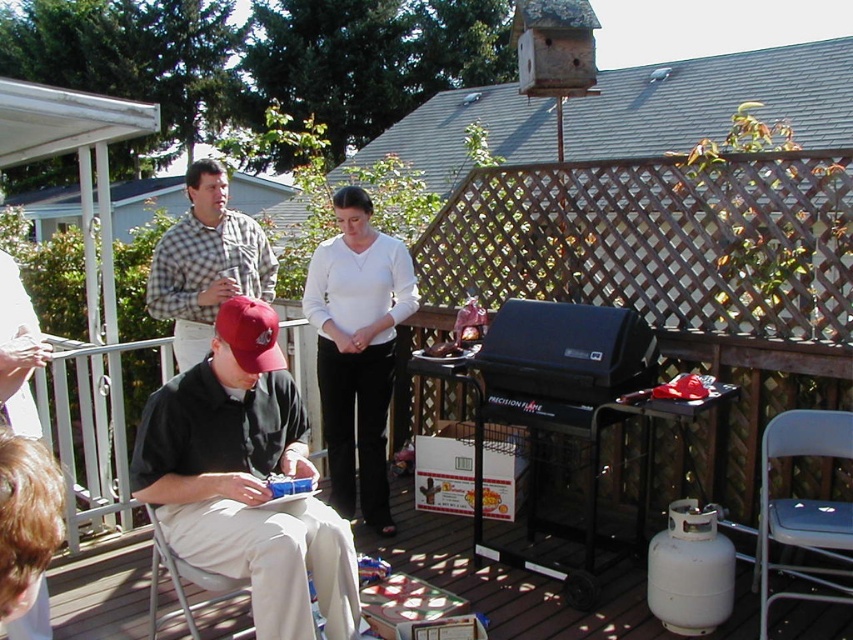
Who is shorter, matte black shirt at center or white smooth pants at center?

Standing shorter between the two is matte black shirt at center.

Locate an element on the screen. Image resolution: width=853 pixels, height=640 pixels. matte black shirt at center is located at coordinates (245, 480).

Image resolution: width=853 pixels, height=640 pixels. In order to click on matte black shirt at center in this screenshot , I will do `click(245, 480)`.

Who is positioned more to the right, matte black shirt at center or white plastic chair at lower left?

white plastic chair at lower left is more to the right.

You are a GUI agent. You are given a task and a screenshot of the screen. Output one action in this format:
    pyautogui.click(x=<x>, y=<y>)
    Task: Click on the matte black shirt at center
    The image size is (853, 640).
    Given the screenshot: What is the action you would take?
    pyautogui.click(x=245, y=480)

Image resolution: width=853 pixels, height=640 pixels. I want to click on matte black shirt at center, so click(245, 480).

Is point (421, 556) behind point (350, 346)?

No, it is not.

Between white plastic chair at lower left and white smooth pants at center, which one has more height?

Standing taller between the two is white smooth pants at center.

This screenshot has height=640, width=853. What are the coordinates of `white plastic chair at lower left` in the screenshot? It's located at (514, 584).